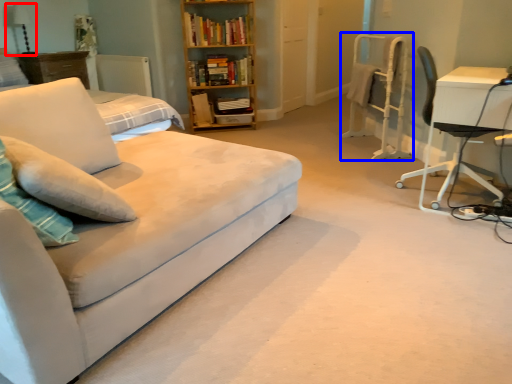
Question: Which point is further to the camera, table lamp (highlighted by a red box) or computer chair (highlighted by a blue box)?

Choices:
 (A) table lamp
 (B) computer chair

Answer: (A)